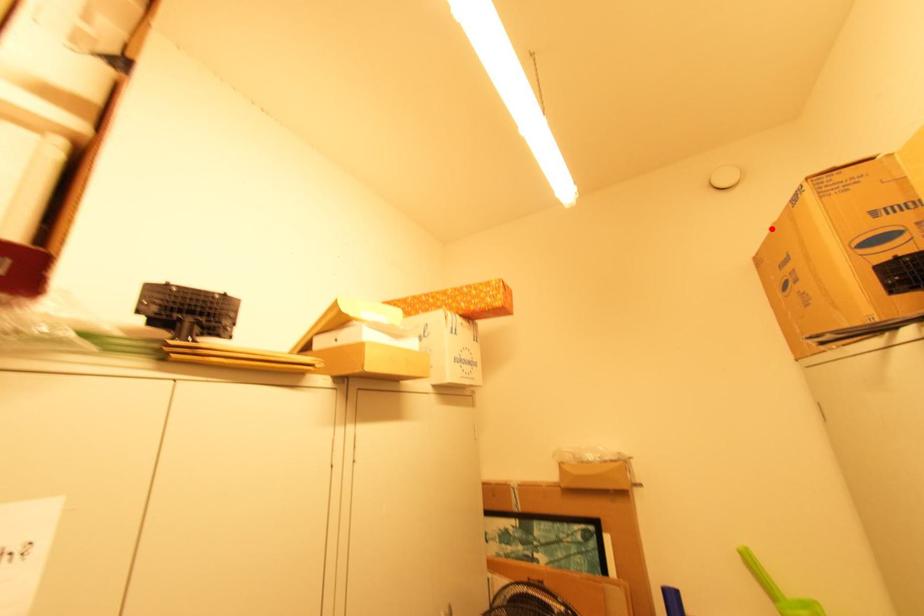
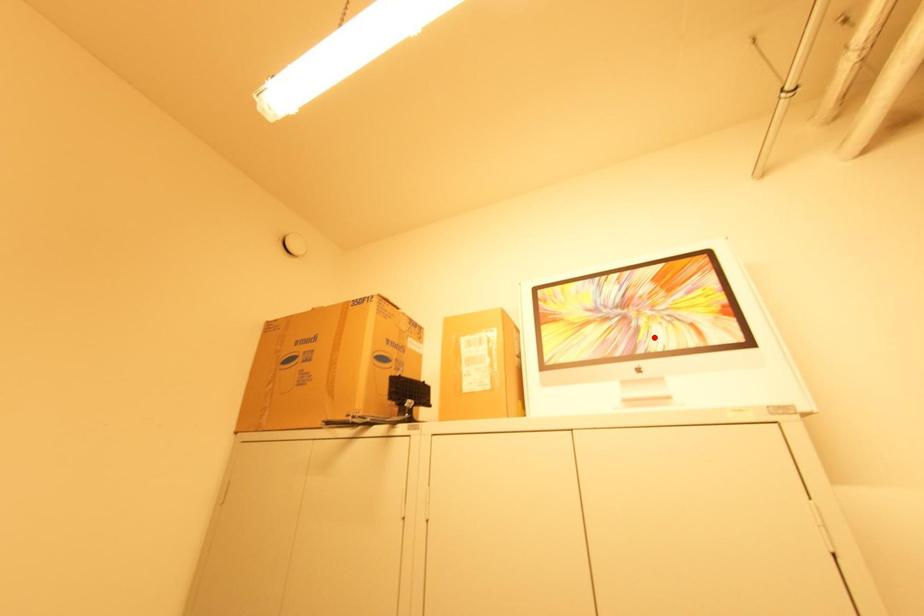
I am providing you with two images of the same scene from different viewpoints. A red point is marked on the first image and another point is marked on the second image. Is the red point in image1 aligned with the point shown in image2?

No